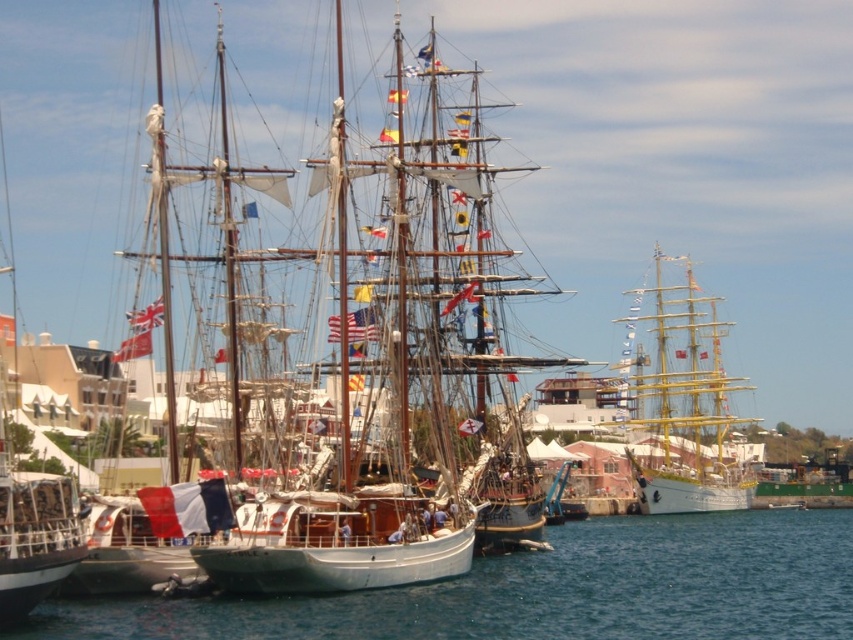
You are standing on the dock and looking at the wooden ship at center and the clear blue water at center. Which object is positioned higher in the image?

The wooden ship at center is located above the clear blue water at center, so it is positioned higher in the image.

You are standing at the camera position observing the maritime scene. There is a point marked at coordinates point (747, 520). Can you determine if this point is within a safe distance for a drone to land?

The point (747, 520) is 627.58 feet away from the camera. Since this distance exceeds typical safe landing ranges for drones, the point is not within a safe distance for a drone to land.

You are navigating a small boat and want to dock at the wooden ship at center. Based on the coordinates provided, can you determine the direction you should head from your current position at point A located at coordinates 0.5, 0.5?

The wooden ship at center is located at point (363, 372). Since your current position is at (426, 320), you should head slightly to the right and down to reach the wooden ship at center.